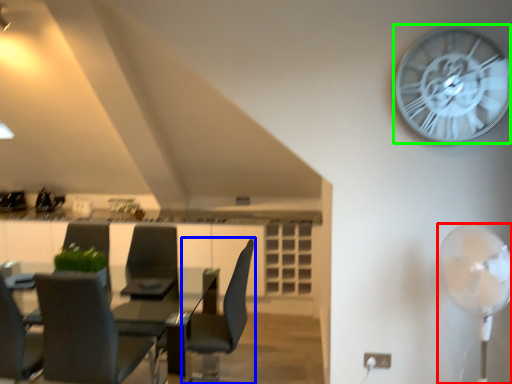
Question: Considering the real-world distances, which object is closest to mechanical fan (highlighted by a red box)? chair (highlighted by a blue box) or wall clock (highlighted by a green box).

Choices:
 (A) chair
 (B) wall clock

Answer: (B)